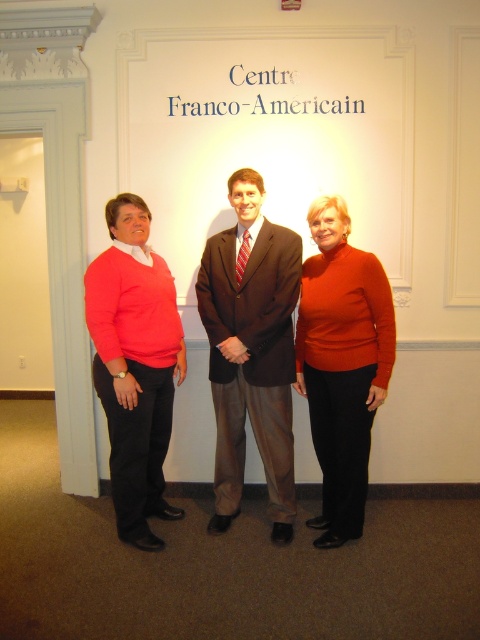
Based on the scene description, where is the matte brown suit at center located in terms of its coordinates?

The matte brown suit at center is located at coordinates point (x=251, y=349).

You are a photographer setting up a shoot in the scene described. You need to ensure that both the matte coral sweater at left and the matte orange sweater at center are fully visible in the frame. Based on their positions, which sweater should you focus on first to avoid any overlap?

The matte coral sweater at left is in front of the matte orange sweater at center, so focusing on the matte coral sweater at left first will ensure it doesn not block the view of the matte orange sweater at center.

You are a photographer setting up for a group photo. You need to arrange the matte brown suit at center and the matte orange sweater at center so that both are visible in the frame. Given their height difference, which person should be positioned closer to the front to avoid blocking the other?

The matte orange sweater at center should be positioned closer to the front since the matte brown suit at center is much taller and could block the view of the shorter person.